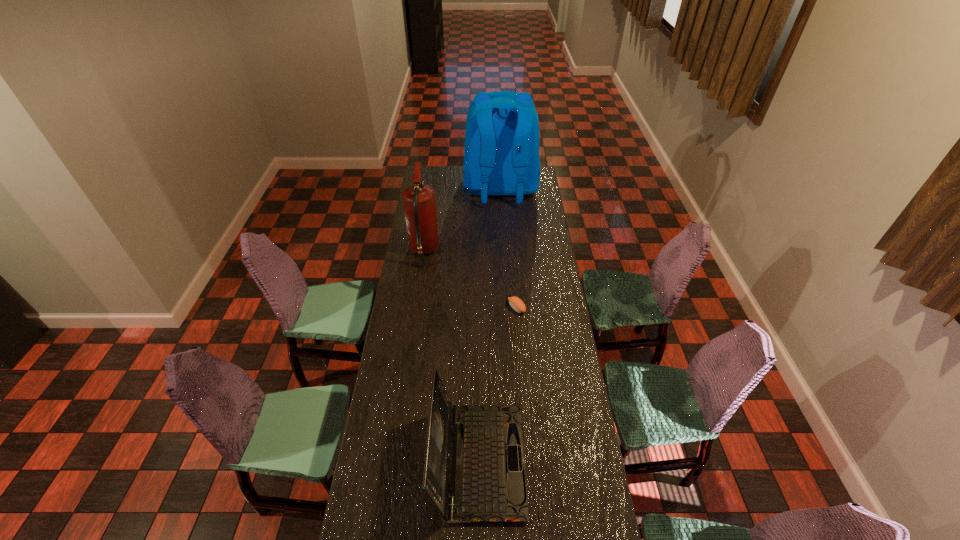
This screenshot has width=960, height=540. Find the location of `free region located on the screen of the laptop computer`. free region located on the screen of the laptop computer is located at coordinates (579, 461).

Find the location of a particular element. free location located on the front of the third farthest object is located at coordinates (519, 337).

Where is `object that is at the far edge`? object that is at the far edge is located at coordinates (501, 155).

This screenshot has height=540, width=960. In order to click on object present at the left edge in this screenshot , I will do `click(419, 202)`.

What are the coordinates of `object located in the right edge section of the desktop` in the screenshot? It's located at (501, 155).

Where is `object at the far right corner`? object at the far right corner is located at coordinates (501, 155).

This screenshot has height=540, width=960. Identify the location of vacant area at the left edge of the desktop. (404, 270).

The image size is (960, 540). In the image, there is a desktop. Identify the location of free region at the right edge. (548, 323).

Locate an element on the screen. The height and width of the screenshot is (540, 960). vacant area that lies between the sushi and the laptop computer is located at coordinates (498, 384).

This screenshot has width=960, height=540. Find the location of `free space between the fire extinguisher and the laptop computer`. free space between the fire extinguisher and the laptop computer is located at coordinates (451, 356).